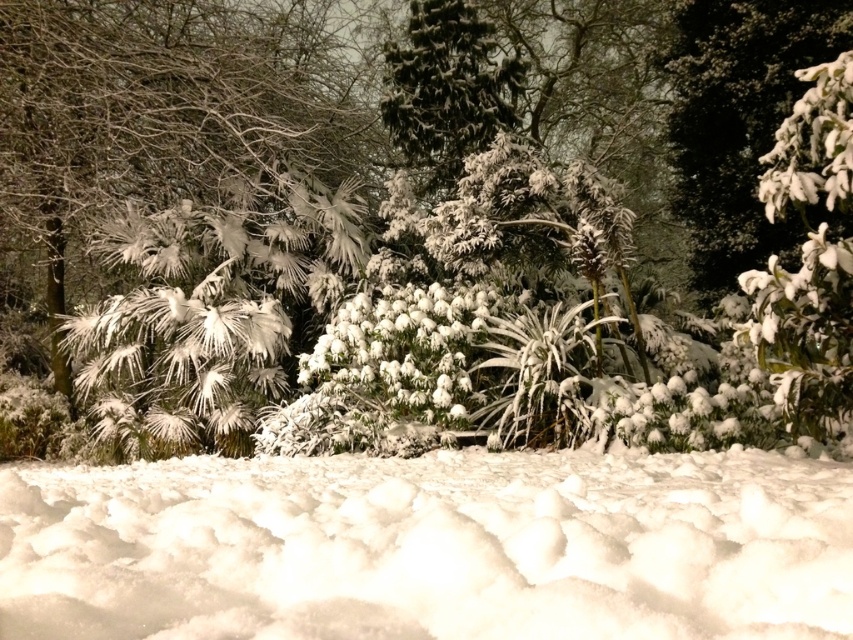
Question: Which of the following is the closest to the observer?

Choices:
 (A) (395, 532)
 (B) (751, 170)

Answer: (A)

Question: Can you confirm if white fluffy snow at lower center is positioned below white fluffy snow at upper right?

Choices:
 (A) no
 (B) yes

Answer: (B)

Question: Considering the relative positions of white fluffy snow at lower center and white fluffy snow at upper right in the image provided, where is white fluffy snow at lower center located with respect to white fluffy snow at upper right?

Choices:
 (A) above
 (B) below

Answer: (B)

Question: Which point is farther to the camera?

Choices:
 (A) white fluffy snow at upper right
 (B) white fluffy snow at lower center

Answer: (A)

Question: Can you confirm if white fluffy snow at lower center is positioned to the right of white fluffy snow at upper right?

Choices:
 (A) no
 (B) yes

Answer: (A)